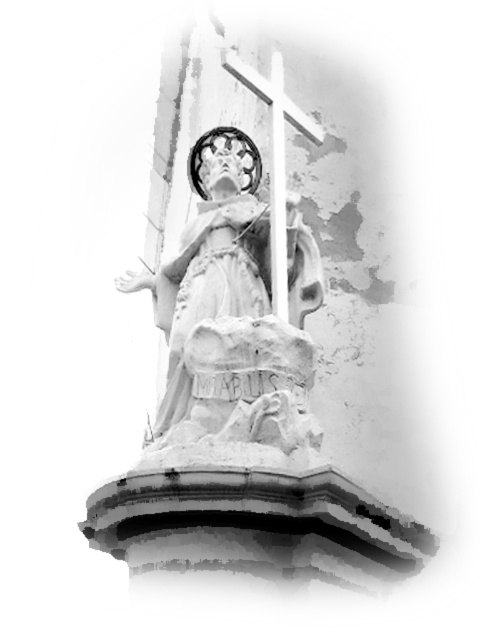
Question: Which point is farther from the camera taking this photo?

Choices:
 (A) (282, 195)
 (B) (292, 442)

Answer: (A)

Question: Can you confirm if white stone statue at center is positioned to the right of white smooth cross at center?

Choices:
 (A) no
 (B) yes

Answer: (A)

Question: Can you confirm if white stone statue at center is thinner than white smooth cross at center?

Choices:
 (A) no
 (B) yes

Answer: (A)

Question: Considering the relative positions of white stone statue at center and white smooth cross at center in the image provided, where is white stone statue at center located with respect to white smooth cross at center?

Choices:
 (A) left
 (B) right

Answer: (A)